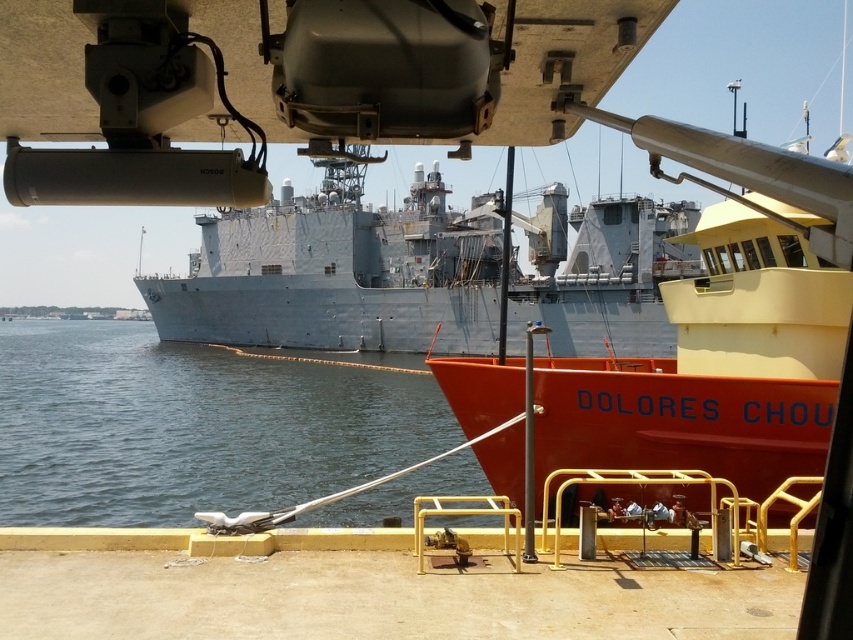
Looking at this image, between clear water at center and gray matte ship at center, which one has less height?

Standing shorter between the two is clear water at center.

You are a GUI agent. You are given a task and a screenshot of the screen. Output one action in this format:
    pyautogui.click(x=<x>, y=<y>)
    Task: Click on the clear water at center
    
    Given the screenshot: What is the action you would take?
    pyautogui.click(x=190, y=426)

This screenshot has height=640, width=853. I want to click on clear water at center, so click(190, 426).

Between orange matte boat at center and clear water at center, which one has more height?

orange matte boat at center

Is point (647, 442) more distant than point (144, 364)?

No, it is in front of (144, 364).

I want to click on orange matte boat at center, so click(x=722, y=330).

Which of these two, orange matte boat at center or gray matte ship at center, stands shorter?

With less height is orange matte boat at center.

Between point (735, 349) and point (590, 244), which one is positioned in front?

Point (735, 349) is more forward.

Where is `orange matte boat at center`? orange matte boat at center is located at coordinates (722, 330).